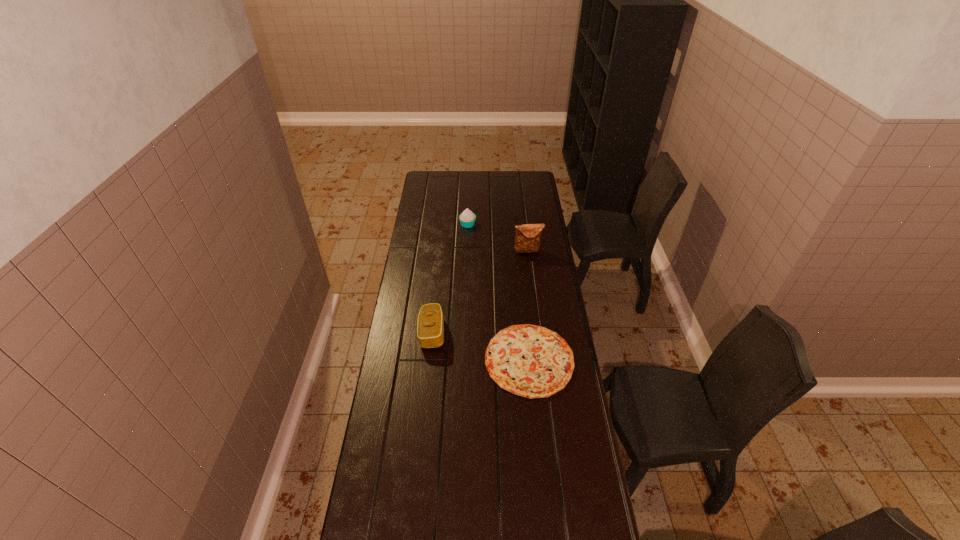
The height and width of the screenshot is (540, 960). In order to click on vacant region located 0.390m on the back of the shortest object in this screenshot , I will do `click(520, 265)`.

Image resolution: width=960 pixels, height=540 pixels. I want to click on object at the left edge, so click(430, 329).

I want to click on clutch bag that is positioned at the right edge, so 527,239.

The width and height of the screenshot is (960, 540). In order to click on pizza that is at the right edge in this screenshot , I will do `click(527, 360)`.

You are a GUI agent. You are given a task and a screenshot of the screen. Output one action in this format:
    pyautogui.click(x=<x>, y=<y>)
    Task: Click on the vacant space at the far edge of the desktop
    Image resolution: width=960 pixels, height=540 pixels.
    Given the screenshot: What is the action you would take?
    pyautogui.click(x=503, y=190)

I want to click on free region at the left edge of the desktop, so click(437, 235).

Where is `free space at the right edge of the desktop`? free space at the right edge of the desktop is located at coordinates (589, 453).

Find the location of a particular element. The height and width of the screenshot is (540, 960). vacant space at the far left corner of the desktop is located at coordinates (434, 179).

The width and height of the screenshot is (960, 540). I want to click on free spot at the far right corner of the desktop, so click(x=537, y=190).

The image size is (960, 540). In order to click on vacant space in between the taller clutch bag and the second object from left to right in this screenshot , I will do click(498, 238).